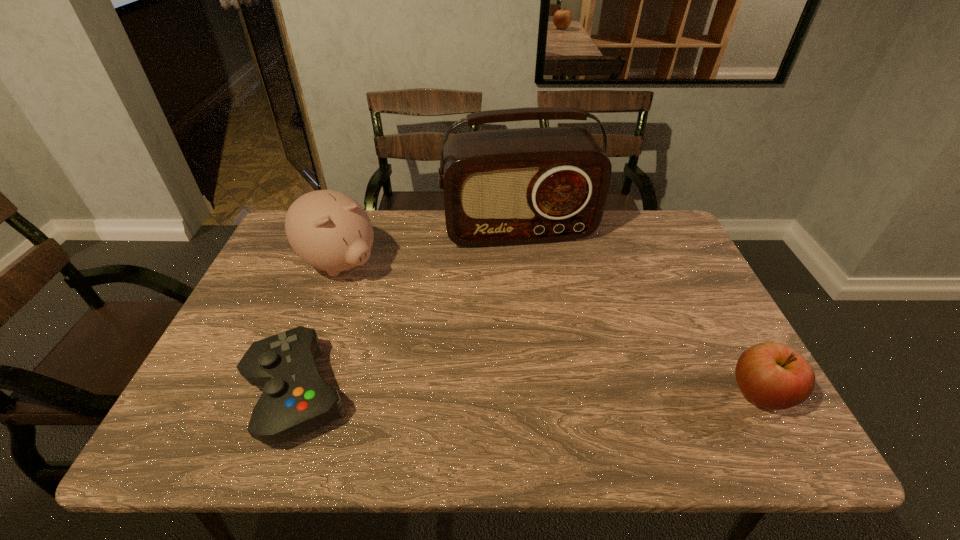
You are a GUI agent. You are given a task and a screenshot of the screen. Output one action in this format:
    pyautogui.click(x=<x>, y=<y>)
    Task: Click on the object that is at the right edge
    Image resolution: width=960 pixels, height=540 pixels.
    Given the screenshot: What is the action you would take?
    [x=772, y=375]

The width and height of the screenshot is (960, 540). I want to click on object positioned at the far left corner, so click(330, 231).

Find the location of a particular element. object located in the near left corner section of the desktop is located at coordinates (296, 400).

Identify the location of object located at the near right corner. (772, 375).

You are a GUI agent. You are given a task and a screenshot of the screen. Output one action in this format:
    pyautogui.click(x=<x>, y=<y>)
    Task: Click on the free location at the far edge
    
    Given the screenshot: What is the action you would take?
    pyautogui.click(x=424, y=249)

Where is `vacant space at the near edge of the desktop`? The width and height of the screenshot is (960, 540). vacant space at the near edge of the desktop is located at coordinates (369, 388).

In the image, there is a desktop. In order to click on blank space at the left edge in this screenshot , I will do `click(237, 374)`.

Find the location of `free space at the right edge`. free space at the right edge is located at coordinates (690, 314).

Find the location of a particular element. The image size is (960, 540). free location at the near left corner of the desktop is located at coordinates (229, 382).

Image resolution: width=960 pixels, height=540 pixels. I want to click on vacant space at the far right corner, so click(x=664, y=239).